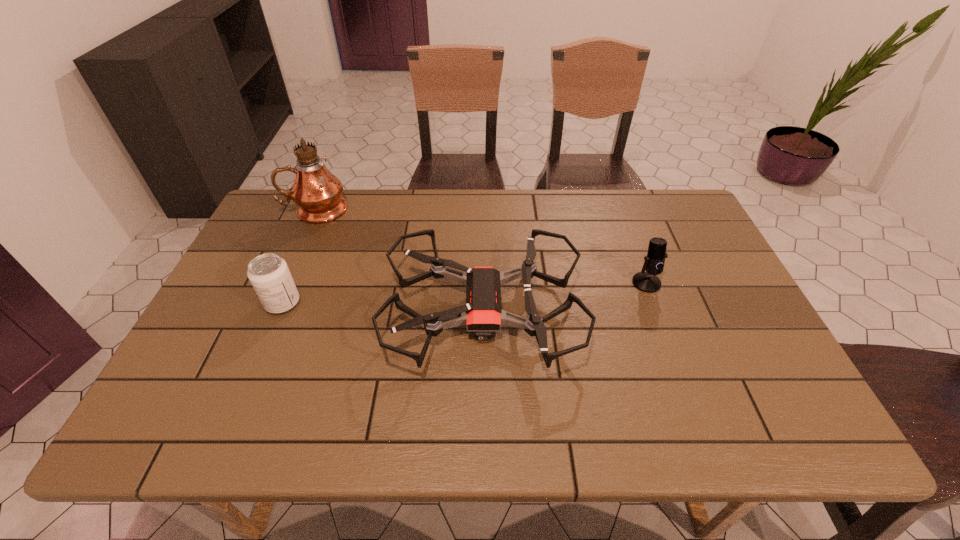
Where is `free region located 0.140m with the camera facing forward on the shortest object`? The image size is (960, 540). free region located 0.140m with the camera facing forward on the shortest object is located at coordinates (331, 312).

Find the location of a particular element. The height and width of the screenshot is (540, 960). vacant space located 0.140m with the camera facing forward on the shortest object is located at coordinates (331, 312).

The width and height of the screenshot is (960, 540). In order to click on object that is positioned at the far edge in this screenshot , I will do `click(317, 192)`.

Where is `oil lamp that is positioned at the left edge`? The height and width of the screenshot is (540, 960). oil lamp that is positioned at the left edge is located at coordinates (317, 192).

At what (x,y) coordinates should I click in order to perform the action: click on soda can at the left edge. Please return your answer as a coordinate pair (x, y). The height and width of the screenshot is (540, 960). Looking at the image, I should click on (268, 273).

Locate an element on the screen. object present at the far left corner is located at coordinates (317, 192).

I want to click on free region at the far edge of the desktop, so click(420, 193).

This screenshot has width=960, height=540. What are the coordinates of `vacant space at the near edge of the desktop` in the screenshot? It's located at (586, 413).

Where is `vacant area at the right edge`? vacant area at the right edge is located at coordinates (697, 259).

Find the location of a particular element. This screenshot has height=540, width=960. vacant space at the far left corner of the desktop is located at coordinates (261, 219).